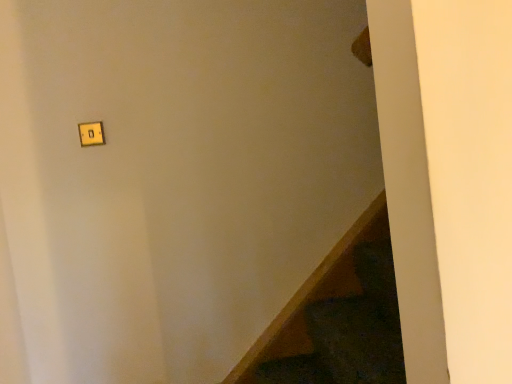
What is the approximate height of gold metallic light switch at upper left?

It is 3.70 inches.

Find the location of a particular element. gold metallic light switch at upper left is located at coordinates (91, 134).

The width and height of the screenshot is (512, 384). What do you see at coordinates (91, 134) in the screenshot?
I see `gold metallic light switch at upper left` at bounding box center [91, 134].

Where is `gold metallic light switch at upper left`? This screenshot has width=512, height=384. gold metallic light switch at upper left is located at coordinates (91, 134).